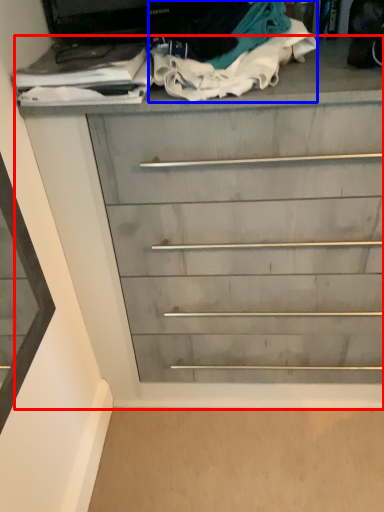
Question: Which object appears closest to the camera in this image, chest of drawers (highlighted by a red box) or clothing (highlighted by a blue box)?

Choices:
 (A) chest of drawers
 (B) clothing

Answer: (B)